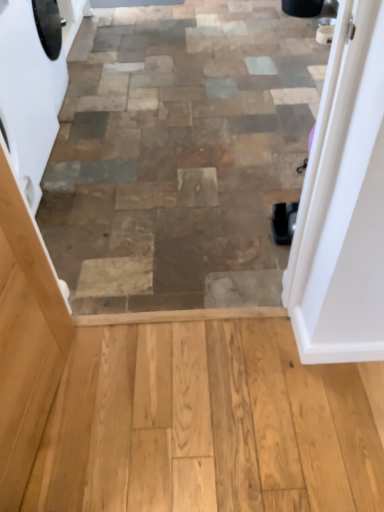
Question: Considering their positions, is light brown wood screen door at left located in front of or behind white glossy washing machine at left?

Choices:
 (A) front
 (B) behind

Answer: (A)

Question: Considering the positions of light brown wood screen door at left and white glossy washing machine at left in the image, is light brown wood screen door at left taller or shorter than white glossy washing machine at left?

Choices:
 (A) short
 (B) tall

Answer: (B)

Question: Considering the real-world distances, which object is farthest from the light brown wood screen door at left?

Choices:
 (A) white glossy washing machine at left
 (B) white glossy door at upper right

Answer: (A)

Question: Considering the real-world distances, which object is farthest from the white glossy door at upper right?

Choices:
 (A) light brown wood screen door at left
 (B) white glossy washing machine at left

Answer: (B)